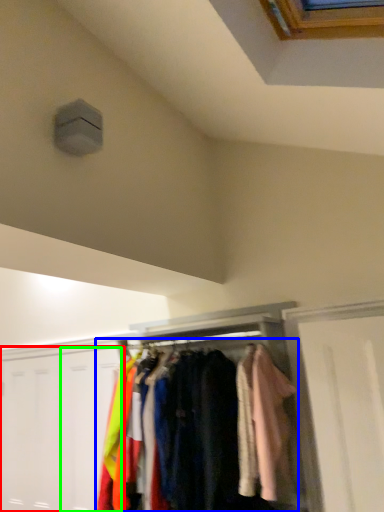
Question: Estimate the real-world distances between objects in this image. Which object is closer to door (highlighted by a red box), garment (highlighted by a blue box) or door (highlighted by a green box)?

Choices:
 (A) garment
 (B) door

Answer: (B)